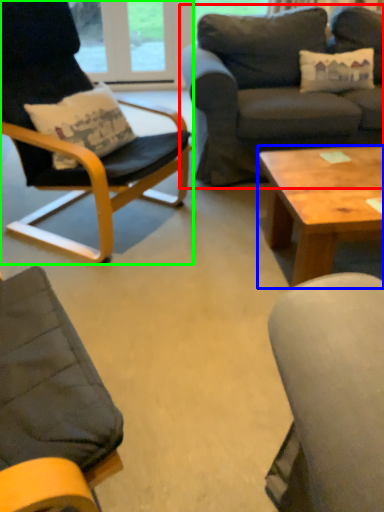
Question: Which is farther away from studio couch (highlighted by a red box)? coffee table (highlighted by a blue box) or chair (highlighted by a green box)?

Choices:
 (A) coffee table
 (B) chair

Answer: (A)